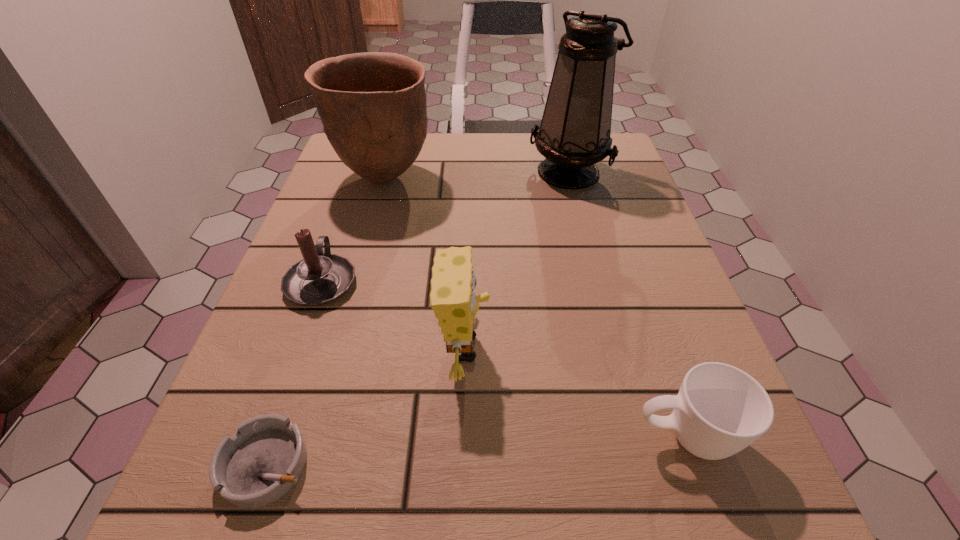
You are a GUI agent. You are given a task and a screenshot of the screen. Output one action in this format:
    pyautogui.click(x=<x>, y=<y>)
    Task: Click on the oil lamp
    
    Given the screenshot: What is the action you would take?
    pyautogui.click(x=574, y=135)

You are a GUI agent. You are given a task and a screenshot of the screen. Output one action in this format:
    pyautogui.click(x=<x>, y=<y>)
    Task: Click on the second tallest object
    The image size is (960, 540).
    Given the screenshot: What is the action you would take?
    pyautogui.click(x=372, y=105)

This screenshot has height=540, width=960. I want to click on sponge, so click(x=452, y=298).

Locate an element on the screen. The image size is (960, 540). the fourth shortest object is located at coordinates (452, 298).

Locate an element on the screen. Image resolution: width=960 pixels, height=540 pixels. candle is located at coordinates 320,277.

This screenshot has height=540, width=960. In order to click on cup in this screenshot , I will do `click(719, 410)`.

Where is `ashtray`? This screenshot has width=960, height=540. ashtray is located at coordinates (263, 460).

Find the location of a particular element. Image resolution: width=960 pixels, height=540 pixels. vacant space situated 0.230m on the left of the tallest object is located at coordinates (435, 171).

This screenshot has width=960, height=540. I want to click on vacant space situated 0.220m on the right of the pottery, so click(525, 178).

The width and height of the screenshot is (960, 540). I want to click on free spot located 0.220m on the face of the sponge, so click(x=626, y=348).